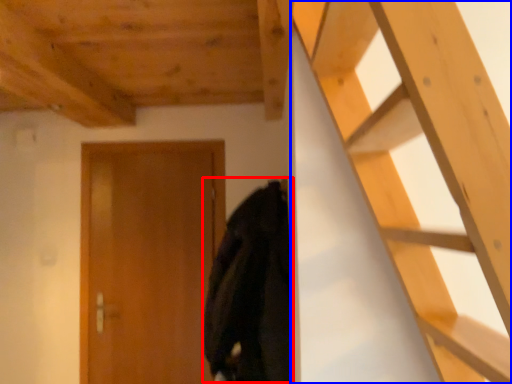
Question: Which of the following is the closest to the observer, cloak (highlighted by a red box) or ladder (highlighted by a blue box)?

Choices:
 (A) cloak
 (B) ladder

Answer: (B)